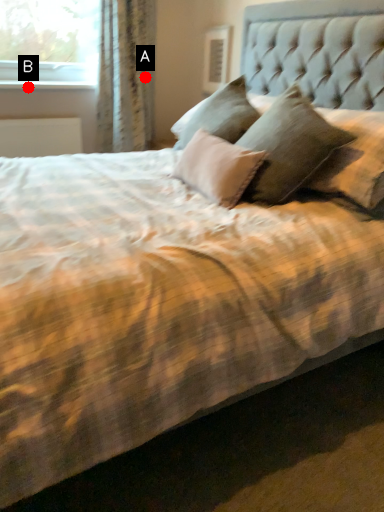
Question: Two points are circled on the image, labeled by A and B beside each circle. Among these points, which one is farthest from the camera?

Choices:
 (A) A is further
 (B) B is further

Answer: (A)